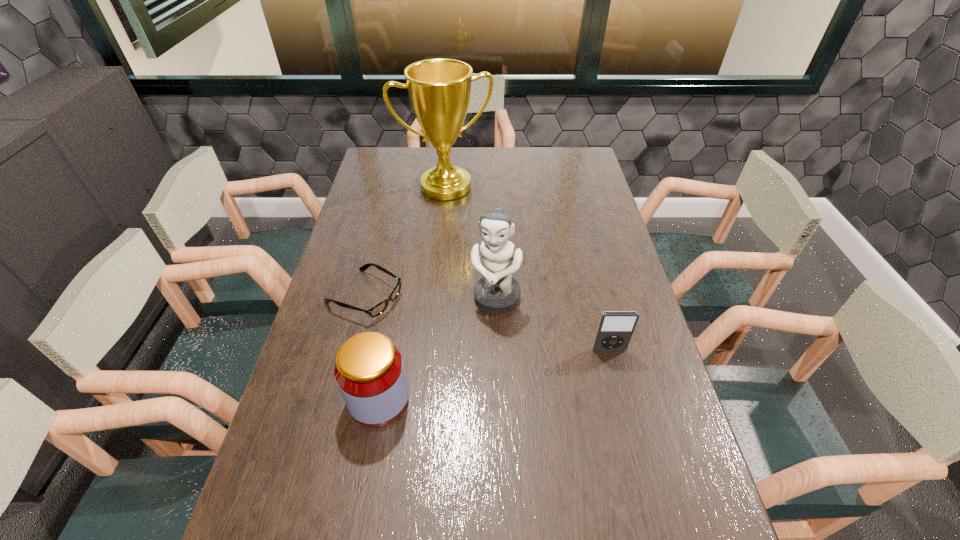
Locate an element on the screen. The height and width of the screenshot is (540, 960). vacant region located by the handles of the farthest object is located at coordinates (463, 217).

Locate an element on the screen. The height and width of the screenshot is (540, 960). vacant space located 0.170m by the handles of the farthest object is located at coordinates (468, 230).

I want to click on free space located by the handles of the farthest object, so click(x=461, y=213).

Where is `free location located on the front-facing side of the figurine`? This screenshot has height=540, width=960. free location located on the front-facing side of the figurine is located at coordinates (469, 392).

At what (x,y) coordinates should I click in order to perform the action: click on vacant region located 0.210m on the front-facing side of the figurine. Please return your answer as a coordinate pair (x, y). Looking at the image, I should click on (472, 382).

The height and width of the screenshot is (540, 960). In order to click on free space located on the front-facing side of the figurine in this screenshot , I will do (x=477, y=365).

The image size is (960, 540). Identify the location of vacant area situated 0.170m on the front-facing side of the spectacles. (444, 334).

The image size is (960, 540). In order to click on vacant space located 0.240m on the front-facing side of the spectacles in this screenshot , I will do `click(465, 344)`.

The image size is (960, 540). I want to click on free space located on the front-facing side of the spectacles, so click(x=437, y=330).

The image size is (960, 540). Find the location of `object at the far edge`. object at the far edge is located at coordinates [439, 90].